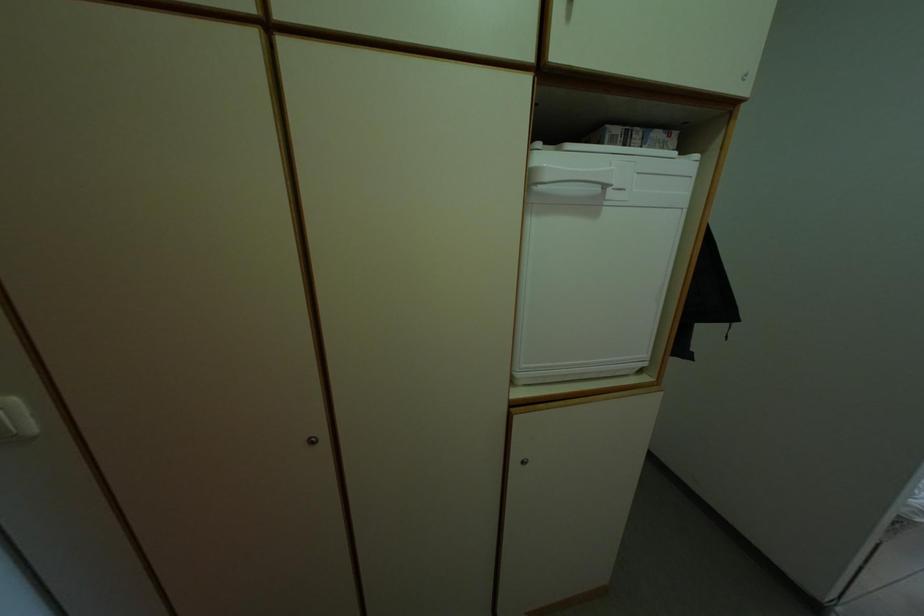
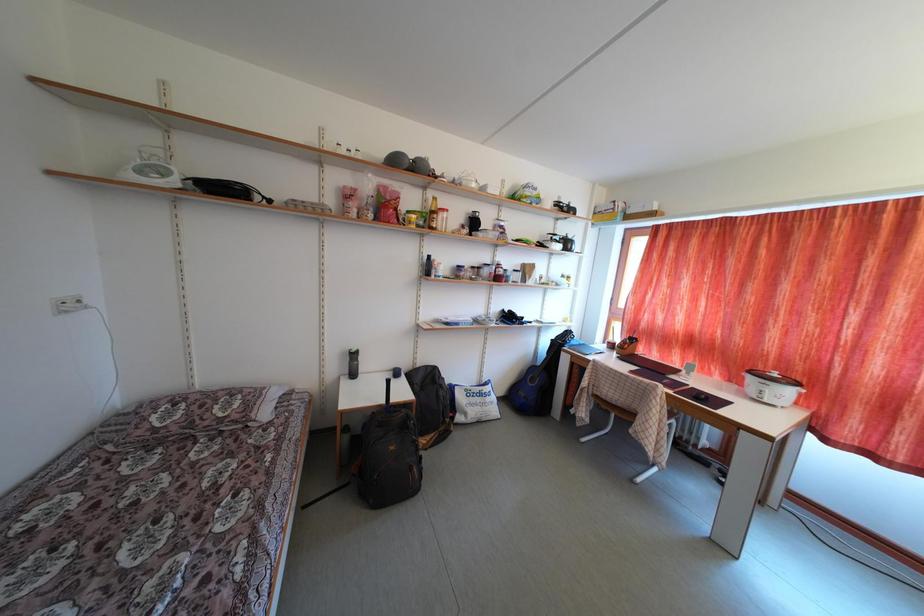
Question: Which direction would the cameraman need to move to produce the second image? Reply with the corresponding letter.

Choices:
 (A) Left
 (B) Right
 (C) Forward
 (D) Backward

Answer: (B)